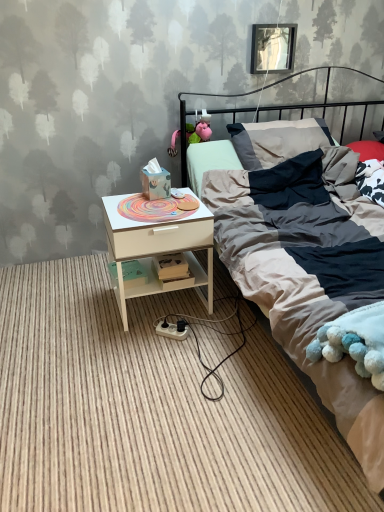
You are a GUI agent. You are given a task and a screenshot of the screen. Output one action in this format:
    pyautogui.click(x=<x>, y=<y>)
    Task: Click on the vacant area in front of white wood nightstand at lower left
    Image resolution: width=384 pixels, height=512 pixels.
    Given the screenshot: What is the action you would take?
    pyautogui.click(x=156, y=354)